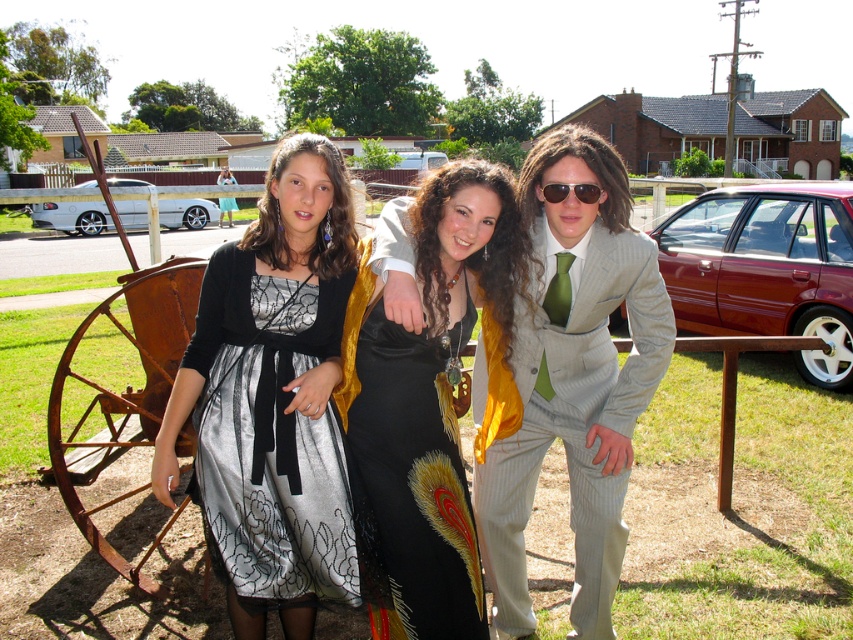
Find the location of a particular element. The image size is (853, 640). light gray pinstripe suit at center is located at coordinates (573, 380).

Is light gray pinstripe suit at center further to camera compared to sunglasses at center?

Yes, light gray pinstripe suit at center is behind sunglasses at center.

At what (x,y) coordinates should I click in order to perform the action: click on light gray pinstripe suit at center. Please return your answer as a coordinate pair (x, y). This screenshot has width=853, height=640. Looking at the image, I should click on (573, 380).

Is point (764, 321) farther from viewer compared to point (550, 188)?

Yes.

Who is more distant from viewer, [721,205] or [547,198]?

Positioned behind is point [721,205].

Image resolution: width=853 pixels, height=640 pixels. I want to click on maroon metallic sedan at right, so point(766,268).

Can you confirm if silver metallic sedan at left is bigger than sunglasses at center?

Yes.

Between silver metallic sedan at left and sunglasses at center, which one appears on the right side from the viewer's perspective?

From the viewer's perspective, sunglasses at center appears more on the right side.

I want to click on silver metallic sedan at left, so click(x=73, y=216).

You are a GUI agent. You are given a task and a screenshot of the screen. Output one action in this format:
    pyautogui.click(x=<x>, y=<y>)
    Task: Click on the silver metallic sedan at left
    
    Given the screenshot: What is the action you would take?
    pyautogui.click(x=73, y=216)